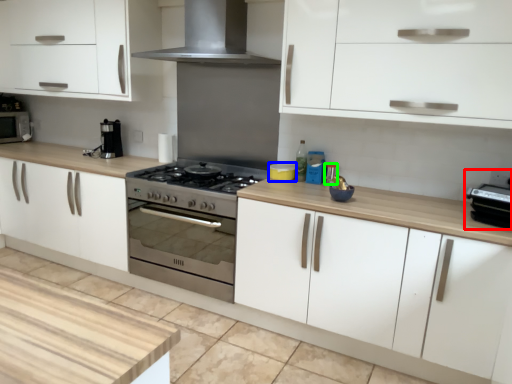
Question: Estimate the real-world distances between objects in this image. Which object is closer to appliance (highlighted by a red box), appliance (highlighted by a blue box) or appliance (highlighted by a green box)?

Choices:
 (A) appliance
 (B) appliance

Answer: (B)